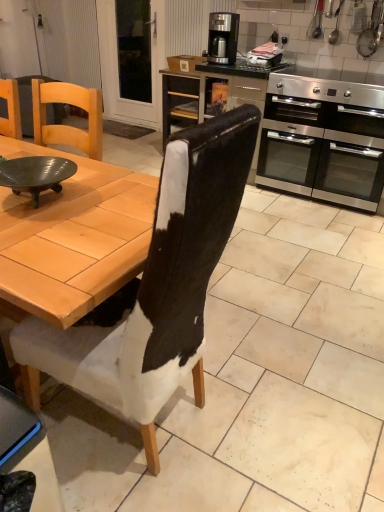
Question: From a real-world perspective, is satin silver coffee maker at upper center physically located above or below metallic silver toaster at upper center, the 2th appliance in the right-to-left sequence?

Choices:
 (A) below
 (B) above

Answer: (B)

Question: From the image's perspective, is satin silver coffee maker at upper center located above or below metallic silver toaster at upper center, the first appliance from the left?

Choices:
 (A) below
 (B) above

Answer: (B)

Question: Estimate the real-world distances between objects in this image. Which object is farther from the stainless steel oven at right?

Choices:
 (A) matte black bowl at left
 (B) transparent glass door at upper left
 (C) metallic silver pot at upper right, which appears as the 2th appliance when viewed from the left
 (D) black leather chair at center
 (E) satin silver coffee maker at upper center

Answer: (D)

Question: Which is nearer to the transparent glass door at upper left?

Choices:
 (A) matte black bowl at left
 (B) black leather chair at center
 (C) metallic silver toaster at upper center, the first appliance from the left
 (D) metallic silver pot at upper right, which appears as the 2th appliance when viewed from the left
 (E) metallic silver oven at center right

Answer: (E)